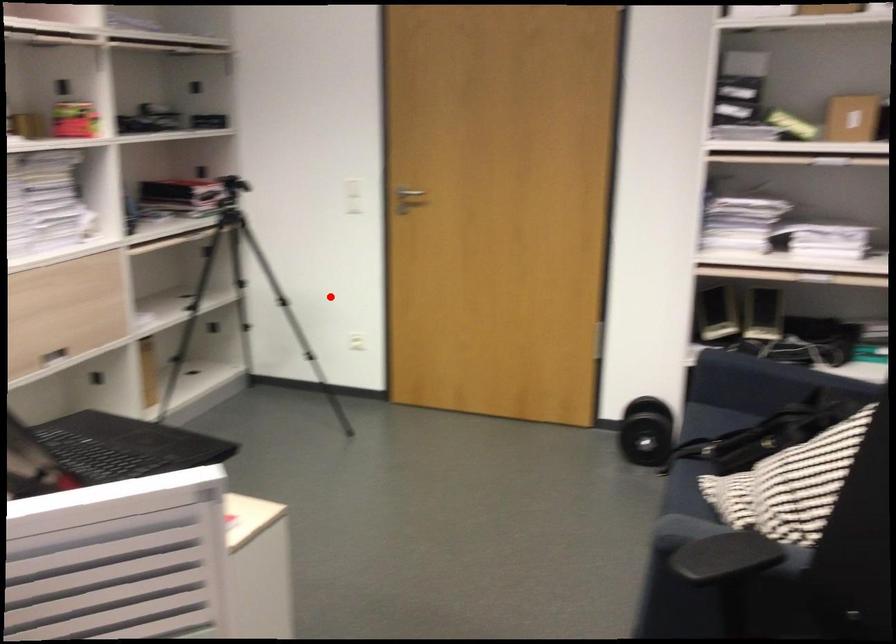
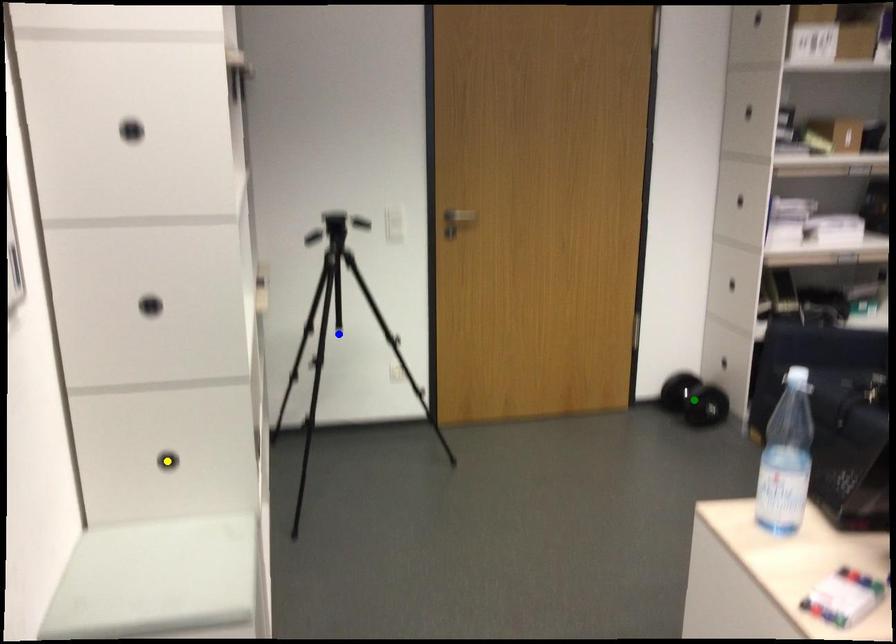
Question: I am providing you with two images of the same scene from different viewpoints. A red point is marked on the first image. You are given multiple points on the second image. Which spot in image 2 lines up with the point in image 1?

Choices:
 (A) green point
 (B) blue point
 (C) yellow point

Answer: (B)